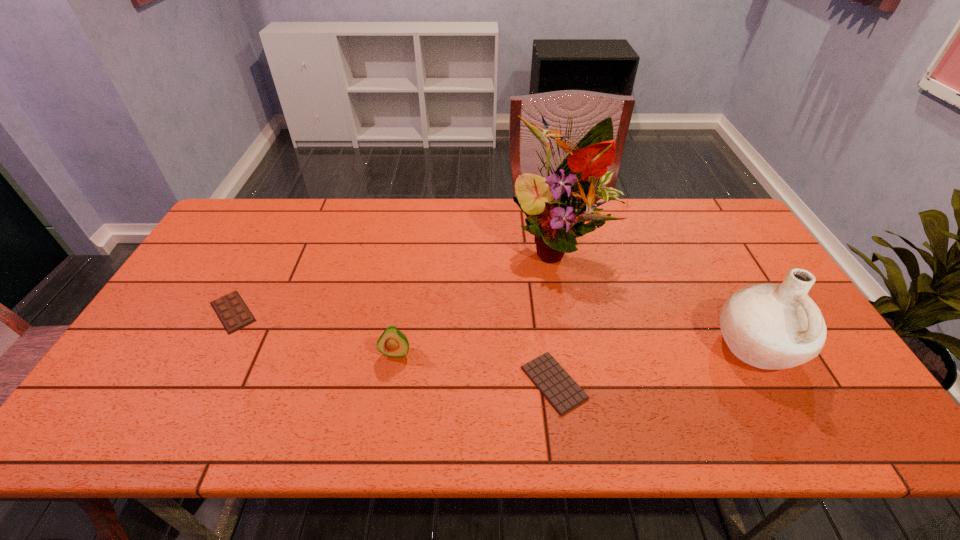
Find the location of a particular element. Image resolution: width=960 pixels, height=540 pixels. the tallest object is located at coordinates (557, 207).

The width and height of the screenshot is (960, 540). What are the coordinates of `bouquet` in the screenshot? It's located at (557, 207).

This screenshot has width=960, height=540. In order to click on the rightmost object in this screenshot , I will do point(769,326).

Identify the location of the fourth shortest object. (769, 326).

Locate an element on the screen. Image resolution: width=960 pixels, height=540 pixels. avocado is located at coordinates (392, 342).

Image resolution: width=960 pixels, height=540 pixels. Find the location of `the third tallest object`. the third tallest object is located at coordinates (392, 342).

Where is `the leftmost object`? This screenshot has height=540, width=960. the leftmost object is located at coordinates (232, 311).

I want to click on the taller chocolate bar, so click(x=232, y=311).

This screenshot has height=540, width=960. What are the coordinates of `the shorter chocolate bar` in the screenshot? It's located at (559, 388).

Find the location of a particular element. The width and height of the screenshot is (960, 540). the right chocolate bar is located at coordinates (x=559, y=388).